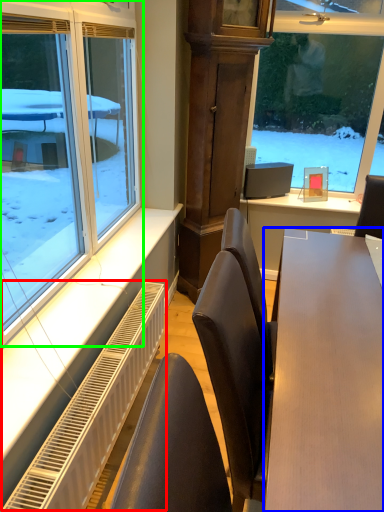
Question: Estimate the real-world distances between objects in this image. Which object is farther from radiator (highlighted by a red box), table (highlighted by a blue box) or window (highlighted by a green box)?

Choices:
 (A) table
 (B) window

Answer: (A)